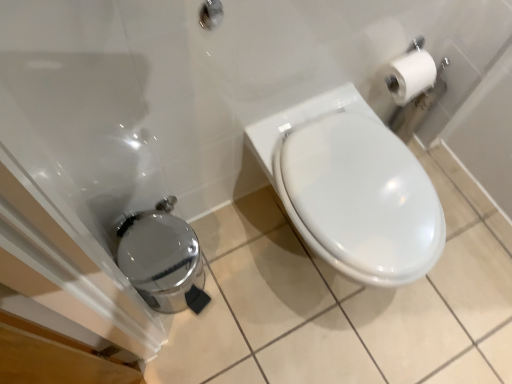
Question: Is the position of white glossy toilet at center less distant than that of brushed metal showerhead at upper center?

Choices:
 (A) yes
 (B) no

Answer: (B)

Question: Is white glossy toilet at center at the right side of brushed metal showerhead at upper center?

Choices:
 (A) no
 (B) yes

Answer: (B)

Question: Is brushed metal showerhead at upper center surrounded by white glossy toilet at center?

Choices:
 (A) yes
 (B) no

Answer: (B)

Question: Can you confirm if white glossy toilet at center is shorter than brushed metal showerhead at upper center?

Choices:
 (A) yes
 (B) no

Answer: (B)

Question: Does white glossy toilet at center have a greater height compared to brushed metal showerhead at upper center?

Choices:
 (A) yes
 (B) no

Answer: (A)

Question: From a real-world perspective, relative to white glossy toilet at center, is brushed metal showerhead at upper center vertically above or below?

Choices:
 (A) above
 (B) below

Answer: (A)

Question: Is brushed metal showerhead at upper center wider or thinner than white glossy toilet at center?

Choices:
 (A) thin
 (B) wide

Answer: (A)

Question: Does point (220, 18) appear closer or farther from the camera than point (352, 152)?

Choices:
 (A) farther
 (B) closer

Answer: (B)

Question: Looking at the image, does brushed metal showerhead at upper center seem bigger or smaller compared to white glossy toilet at center?

Choices:
 (A) big
 (B) small

Answer: (B)

Question: Relative to brushed metal showerhead at upper center, is white glossy toilet at center in front or behind?

Choices:
 (A) front
 (B) behind

Answer: (B)

Question: Is white glossy toilet at center taller or shorter than brushed metal showerhead at upper center?

Choices:
 (A) short
 (B) tall

Answer: (B)

Question: In terms of size, does white glossy toilet at center appear bigger or smaller than brushed metal showerhead at upper center?

Choices:
 (A) small
 (B) big

Answer: (B)

Question: In the image, is white glossy toilet at center on the left side or the right side of brushed metal showerhead at upper center?

Choices:
 (A) right
 (B) left

Answer: (A)

Question: In terms of width, does polished stainless steel trash can at lower left look wider or thinner when compared to white glossy toilet at center?

Choices:
 (A) thin
 (B) wide

Answer: (A)

Question: Looking at the image, does polished stainless steel trash can at lower left seem bigger or smaller compared to white glossy toilet at center?

Choices:
 (A) small
 (B) big

Answer: (A)